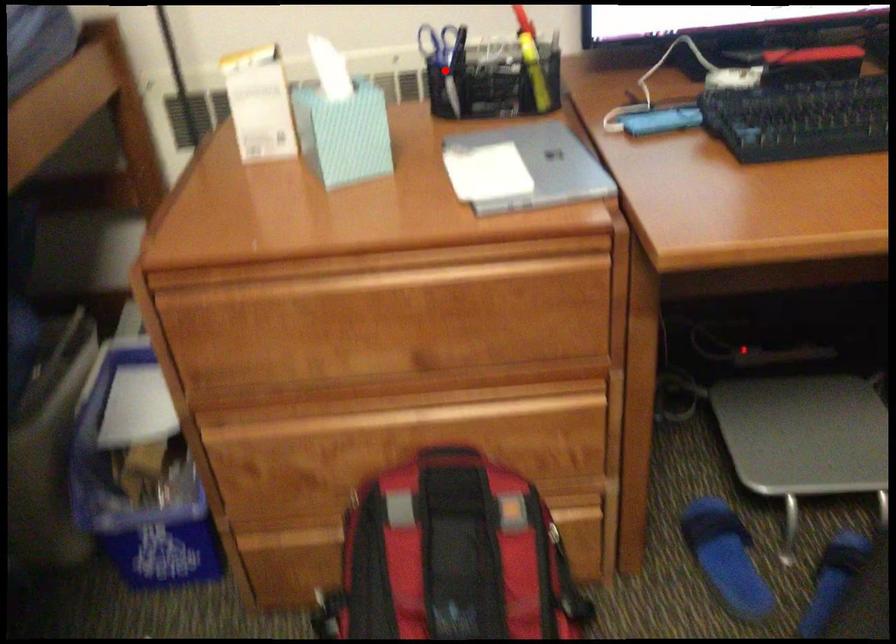
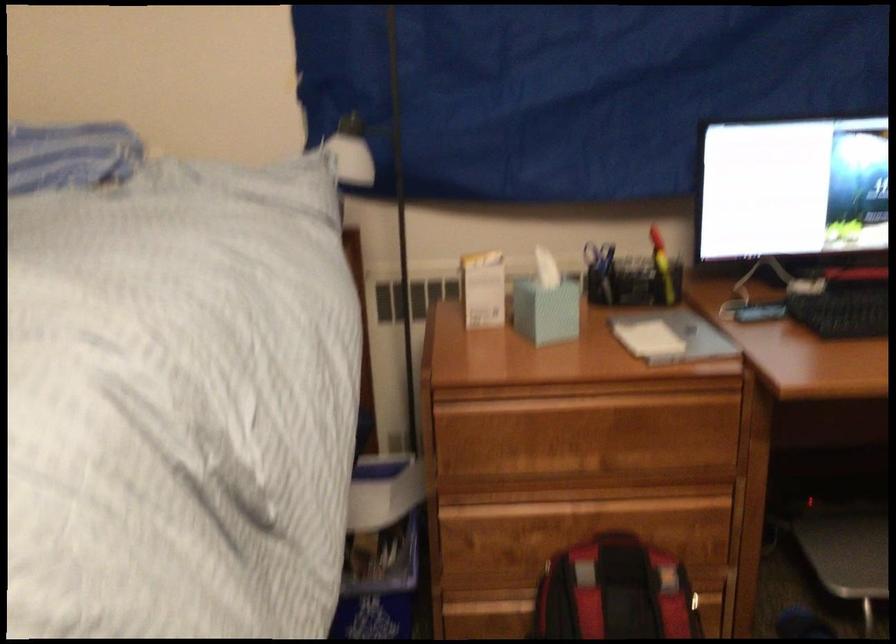
Question: I am providing you with two images of the same scene from different viewpoints. In image1, a red point is highlighted. Considering the same 3D point in image2, which of the following is correct?

Choices:
 (A) It is closer
 (B) It is farther

Answer: (B)